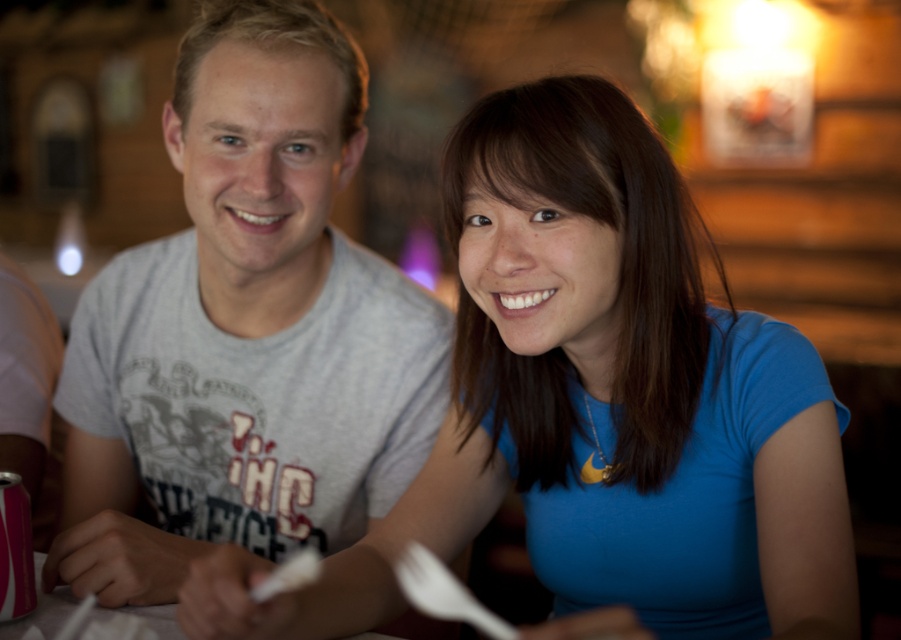
Is blue matte shirt at center closer to camera compared to gray cotton t-shirt at center?

Yes, blue matte shirt at center is closer to the viewer.

Is blue matte shirt at center behind gray cotton t-shirt at center?

Answer: No, it is not.

Is point (526, 124) positioned behind point (174, 504)?

No, it is in front of (174, 504).

Find the location of a particular element. blue matte shirt at center is located at coordinates (580, 388).